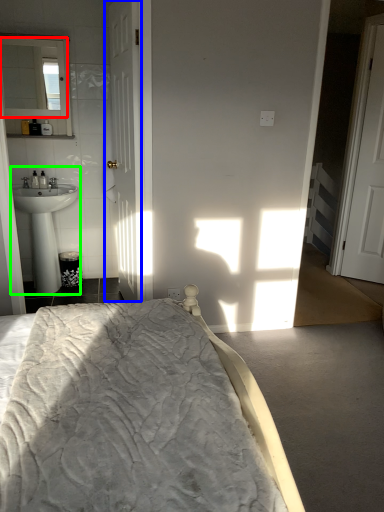
Question: Considering the real-world distances, which object is closest to mirror (highlighted by a red box)? door (highlighted by a blue box) or sink (highlighted by a green box).

Choices:
 (A) door
 (B) sink

Answer: (A)